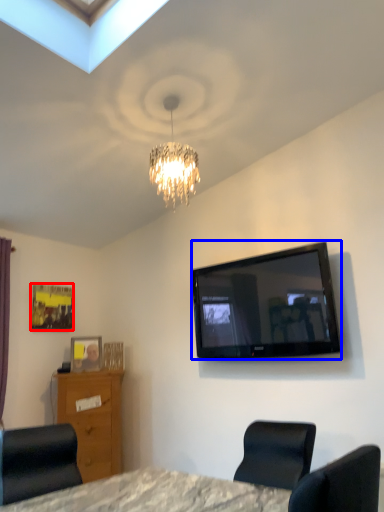
Question: Which object is closer to the camera taking this photo, picture frame (highlighted by a red box) or television (highlighted by a blue box)?

Choices:
 (A) picture frame
 (B) television

Answer: (B)